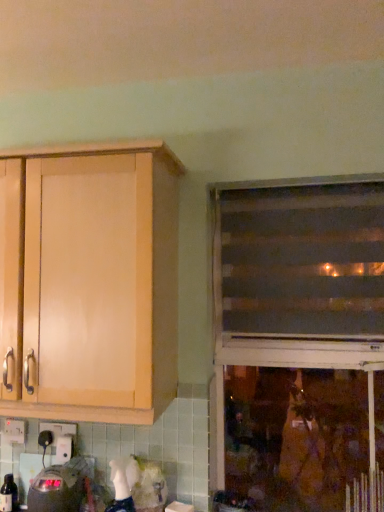
Question: From the image's perspective, is black plastic electric outlet at lower left, the 1th electric outlet when ordered from right to left, below white plastic electric outlet at lower left, the first electric outlet from the left?

Choices:
 (A) no
 (B) yes

Answer: (A)

Question: Can you confirm if black plastic electric outlet at lower left, the 1th electric outlet when ordered from right to left, is wider than white plastic electric outlet at lower left, the first electric outlet from the left?

Choices:
 (A) no
 (B) yes

Answer: (B)

Question: Is black plastic electric outlet at lower left, the 1th electric outlet when ordered from right to left, oriented away from white plastic electric outlet at lower left, the first electric outlet from the left?

Choices:
 (A) yes
 (B) no

Answer: (B)

Question: Is black plastic electric outlet at lower left, which ranks as the second electric outlet in left-to-right order, not within white plastic electric outlet at lower left, the first electric outlet from the left?

Choices:
 (A) yes
 (B) no

Answer: (A)

Question: Is black plastic electric outlet at lower left, which ranks as the second electric outlet in left-to-right order, further to the viewer compared to white plastic electric outlet at lower left, which appears as the 2th electric outlet when viewed from the right?

Choices:
 (A) yes
 (B) no

Answer: (B)

Question: Can you confirm if black plastic electric outlet at lower left, which ranks as the second electric outlet in left-to-right order, is bigger than white plastic electric outlet at lower left, the first electric outlet from the left?

Choices:
 (A) no
 (B) yes

Answer: (B)

Question: From the image's perspective, does light wood cabinet at upper left appear lower than metallic silver radiator at lower right?

Choices:
 (A) no
 (B) yes

Answer: (A)

Question: Does light wood cabinet at upper left have a greater height compared to metallic silver radiator at lower right?

Choices:
 (A) yes
 (B) no

Answer: (A)

Question: Does light wood cabinet at upper left have a greater width compared to metallic silver radiator at lower right?

Choices:
 (A) yes
 (B) no

Answer: (A)

Question: Is light wood cabinet at upper left to the right of metallic silver radiator at lower right from the viewer's perspective?

Choices:
 (A) no
 (B) yes

Answer: (A)

Question: Is light wood cabinet at upper left far away from metallic silver radiator at lower right?

Choices:
 (A) yes
 (B) no

Answer: (A)

Question: Is light wood cabinet at upper left aimed at metallic silver radiator at lower right?

Choices:
 (A) no
 (B) yes

Answer: (A)

Question: Is brown striped blinds at right, positioned as the first window in top-to-bottom order, thinner than matte wooden window at right, placed as the first window when sorted from bottom to top?

Choices:
 (A) yes
 (B) no

Answer: (B)